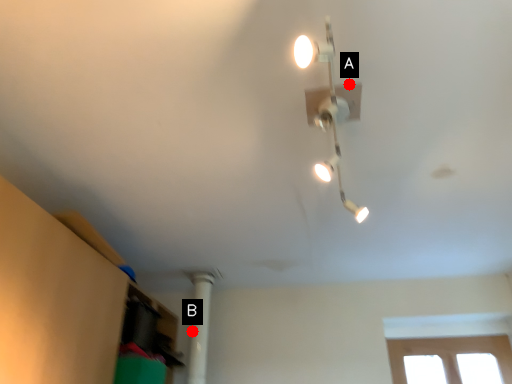
Question: Two points are circled on the image, labeled by A and B beside each circle. Which of the following is the farthest from the observer?

Choices:
 (A) A is further
 (B) B is further

Answer: (B)